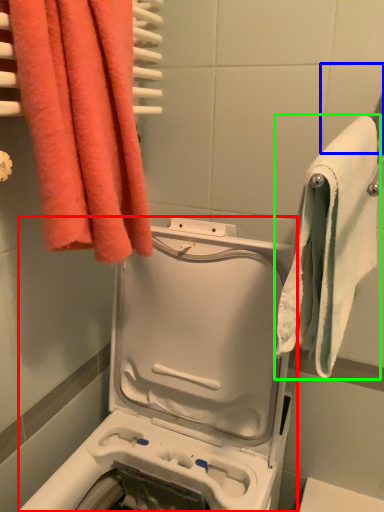
Question: Which object is the closest to the washing machine (highlighted by a red box)? Choose among these: tile (highlighted by a blue box) or towel (highlighted by a green box).

Choices:
 (A) tile
 (B) towel

Answer: (B)